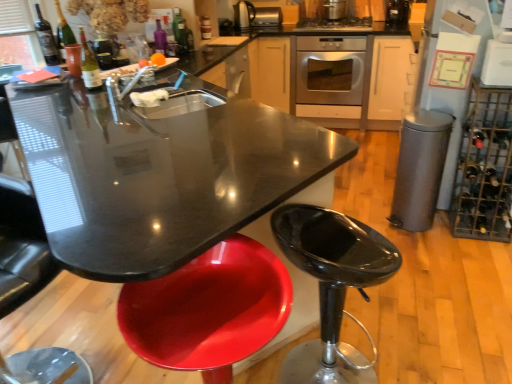
This screenshot has width=512, height=384. What are the coordinates of `free space in front of metallic gray trash can at right, the 4th appliance when ordered from left to right` in the screenshot? It's located at (429, 248).